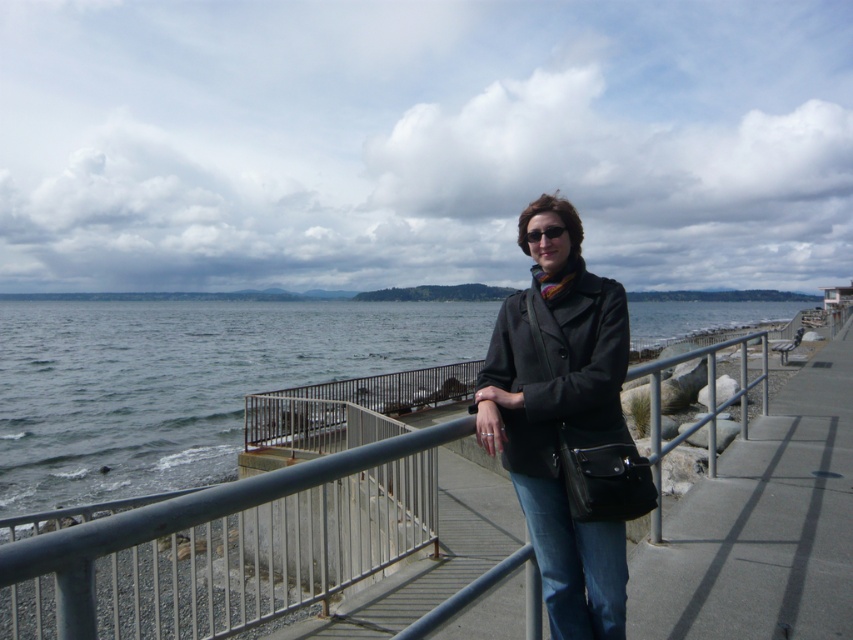
Who is shorter, matte black coat at center or multicolored knitted scarf at center?

With less height is multicolored knitted scarf at center.

Can you confirm if matte black coat at center is positioned below multicolored knitted scarf at center?

Indeed, matte black coat at center is positioned under multicolored knitted scarf at center.

Between point (552, 588) and point (572, 275), which one is positioned in front?

Positioned in front is point (572, 275).

Locate an element on the screen. This screenshot has width=853, height=640. matte black coat at center is located at coordinates (558, 438).

Does metallic gray railing at center have a lesser height compared to denim at center?

No, metallic gray railing at center is not shorter than denim at center.

Between metallic gray railing at center and denim at center, which one has less height?

Standing shorter between the two is denim at center.

Who is more distant from viewer, (173, 554) or (523, 502)?

Positioned behind is point (173, 554).

This screenshot has height=640, width=853. I want to click on metallic gray railing at center, so click(x=227, y=545).

Is black matte coat at center below multicolored knitted scarf at center?

Indeed, black matte coat at center is positioned under multicolored knitted scarf at center.

Which is below, black matte coat at center or multicolored knitted scarf at center?

black matte coat at center

Where is `black matte coat at center`? The image size is (853, 640). black matte coat at center is located at coordinates (556, 365).

Image resolution: width=853 pixels, height=640 pixels. In order to click on black matte coat at center in this screenshot , I will do `click(556, 365)`.